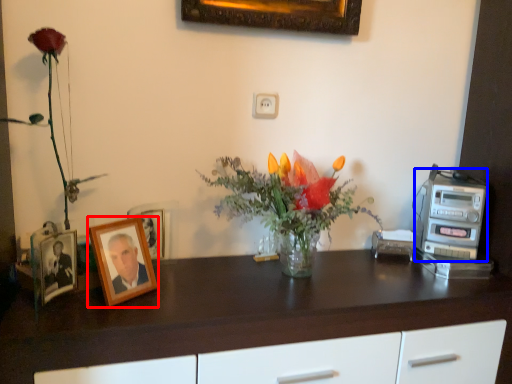
Question: Which object is further to the camera taking this photo, picture frame (highlighted by a red box) or appliance (highlighted by a blue box)?

Choices:
 (A) picture frame
 (B) appliance

Answer: (B)